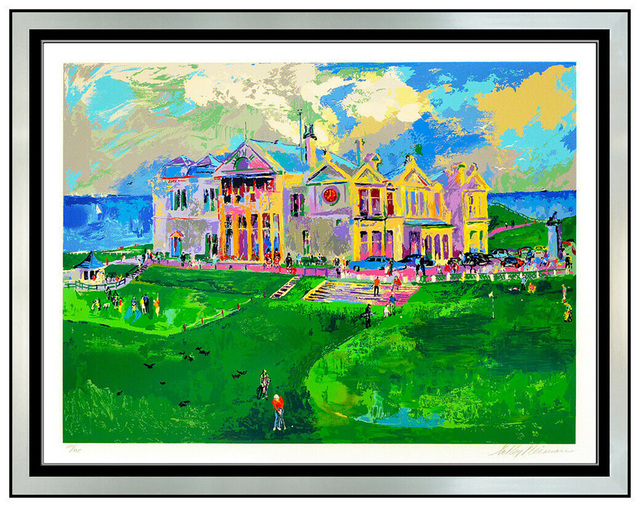
Where is `white mat`? white mat is located at coordinates (587, 406).